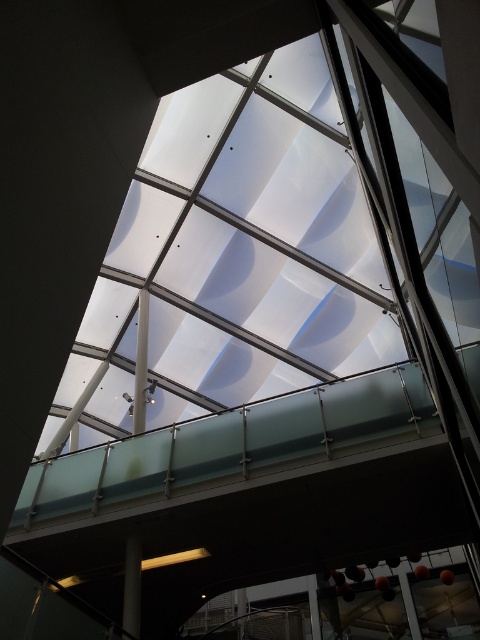
You are an architect designing a new lighting system for the space. You need to ensure that both the white glossy pillar at center and the smooth gray pillar at lower left receive adequate lighting. Given their sizes, which pillar requires more focused lighting to ensure visibility?

The white glossy pillar at center requires more focused lighting because it has a larger size compared to the smooth gray pillar at lower left, making it more prominent and needing better illumination for visibility.

Based on the photo, you are standing on the glass walkway and looking up at the skylight. There are two points marked on the walkway at coordinates point (139,403) and point (123,596). Which point is closer to you as you stand on the walkway?

Point (139,403) is closer to you than point (123,596) because it is further to the viewer, meaning it is positioned nearer to your current position on the walkway.